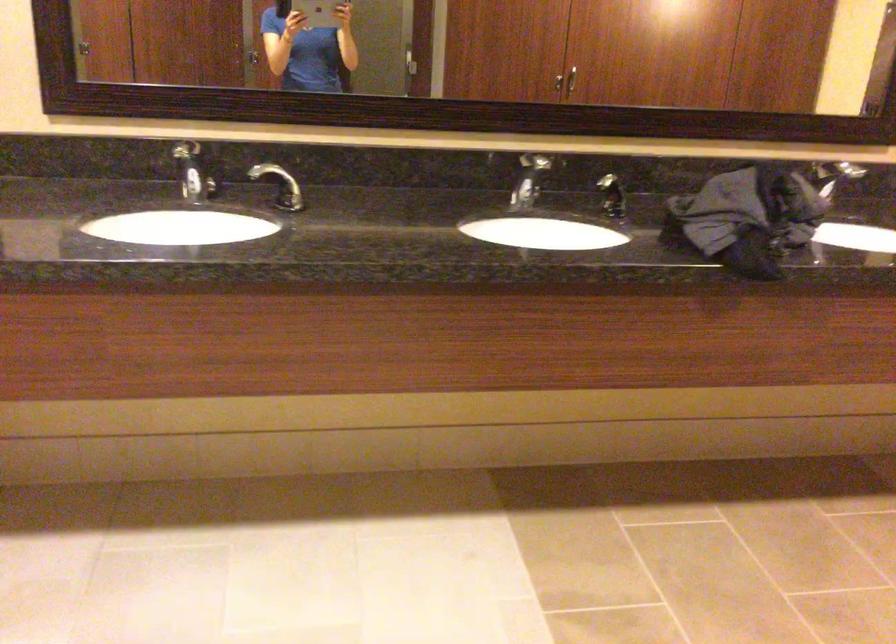
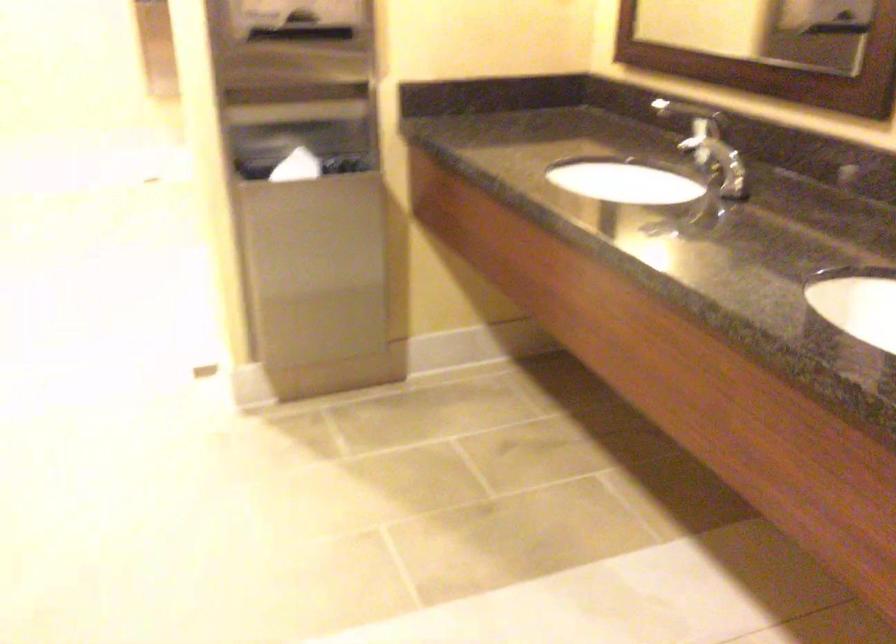
The first image is from the beginning of the video and the second image is from the end. How did the camera likely rotate when shooting the video?

The rotation direction of the camera is left-down.